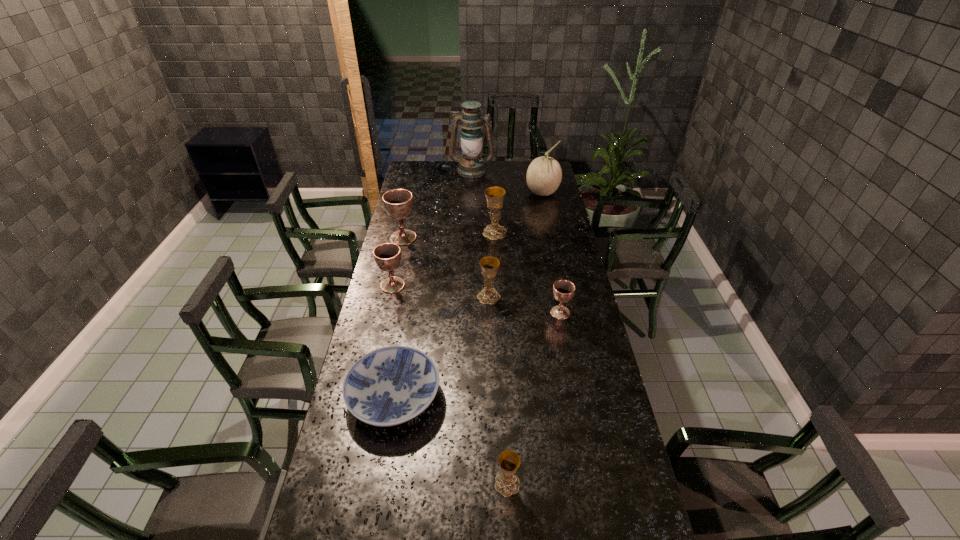
The image size is (960, 540). In order to click on oil lamp in this screenshot , I will do `click(471, 166)`.

The height and width of the screenshot is (540, 960). I want to click on rust oil lamp, so click(471, 166).

The width and height of the screenshot is (960, 540). I want to click on the second farthest object, so click(x=544, y=174).

What are the coordinates of `the second tallest object` in the screenshot? It's located at (544, 174).

The image size is (960, 540). Find the location of `the biggest gold chalice`. the biggest gold chalice is located at coordinates (494, 195).

Identify the location of the biggest brown chalice. coord(398,203).

In order to click on the second smallest gold chalice in this screenshot , I will do `click(489, 264)`.

Where is `the second smallest brown chalice`? Image resolution: width=960 pixels, height=540 pixels. the second smallest brown chalice is located at coordinates (387, 256).

You are a GUI agent. You are given a task and a screenshot of the screen. Output one action in this format:
    pyautogui.click(x=<x>, y=<y>)
    Task: Click on the smallest brown chalice
    Image resolution: width=960 pixels, height=540 pixels.
    Given the screenshot: What is the action you would take?
    pyautogui.click(x=563, y=290)

Find the location of a particular element. the nearest brown chalice is located at coordinates 563,290.